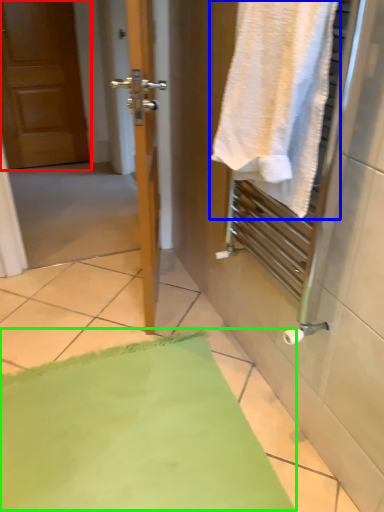
Question: Considering the real-world distances, which object is farthest from door (highlighted by a red box)? towel (highlighted by a blue box) or bath mat (highlighted by a green box)?

Choices:
 (A) towel
 (B) bath mat

Answer: (A)